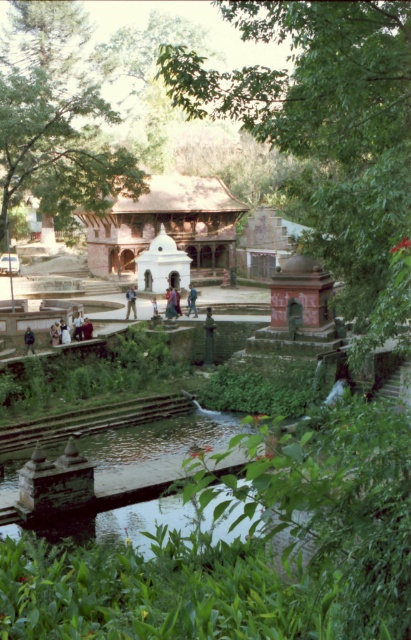
You are a tailor who needs to determine which pair of jeans has a wider leg opening. You see the blue denim jeans at center and the dark blue jeans at lower left in the image. Which pair has a wider leg opening?

The blue denim jeans at center has a wider leg opening since its width is larger than the dark blue jeans at lower left.